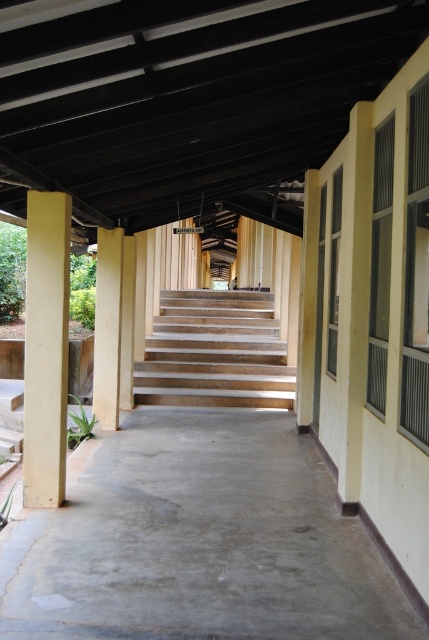
Consider the image. Which is above, gray concrete floor at center or beige concrete pillar at left?

Positioned higher is beige concrete pillar at left.

Who is positioned more to the left, gray concrete floor at center or beige concrete pillar at left?

Positioned to the left is beige concrete pillar at left.

Between point (298, 586) and point (45, 435), which one is positioned behind?

The point (45, 435) is more distant.

Find the location of a particular element. gray concrete floor at center is located at coordinates (199, 541).

Does wooden stairs at center have a larger size compared to light yellow wood pillar at center?

Correct, wooden stairs at center is larger in size than light yellow wood pillar at center.

Is point (227, 378) positioned after point (112, 307)?

Yes, point (227, 378) is behind point (112, 307).

Locate an element on the screen. wooden stairs at center is located at coordinates (214, 353).

Between gray concrete floor at center and wooden stairs at center, which one is positioned lower?

gray concrete floor at center

Who is more distant from viewer, [248,524] or [281,392]?

Point [281,392]

I want to click on gray concrete floor at center, so click(199, 541).